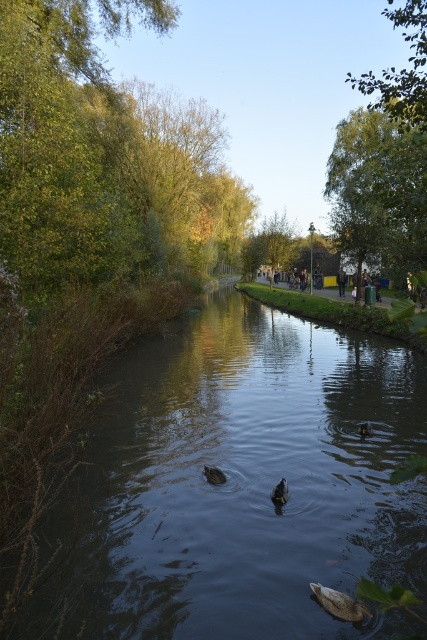
Question: Among these points, which one is farthest from the camera?

Choices:
 (A) (344, 609)
 (B) (222, 481)
 (C) (284, 481)
 (D) (111, 563)

Answer: (B)

Question: Is brown matte duck at lower center wider than dark brown feathers at center?

Choices:
 (A) no
 (B) yes

Answer: (B)

Question: Is dark brown water at center smaller than brown fuzzy duck at center?

Choices:
 (A) yes
 (B) no

Answer: (B)

Question: Is green leafy tree at right above light brown leather jacket at center?

Choices:
 (A) yes
 (B) no

Answer: (A)

Question: Based on their relative distances, which object is farther from the green leafy tree at upper center?

Choices:
 (A) dark brown water at center
 (B) dark gray matte duck at center

Answer: (B)

Question: Which object is farther from the camera taking this photo?

Choices:
 (A) light brown leather jacket at center
 (B) dark brown feathers at center
 (C) dark brown water at center

Answer: (A)